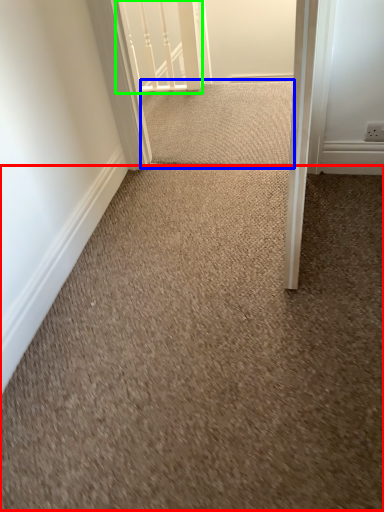
Question: Which object is the farthest from granite (highlighted by a red box)? Choose among these: doormat (highlighted by a blue box) or rail (highlighted by a green box).

Choices:
 (A) doormat
 (B) rail

Answer: (B)